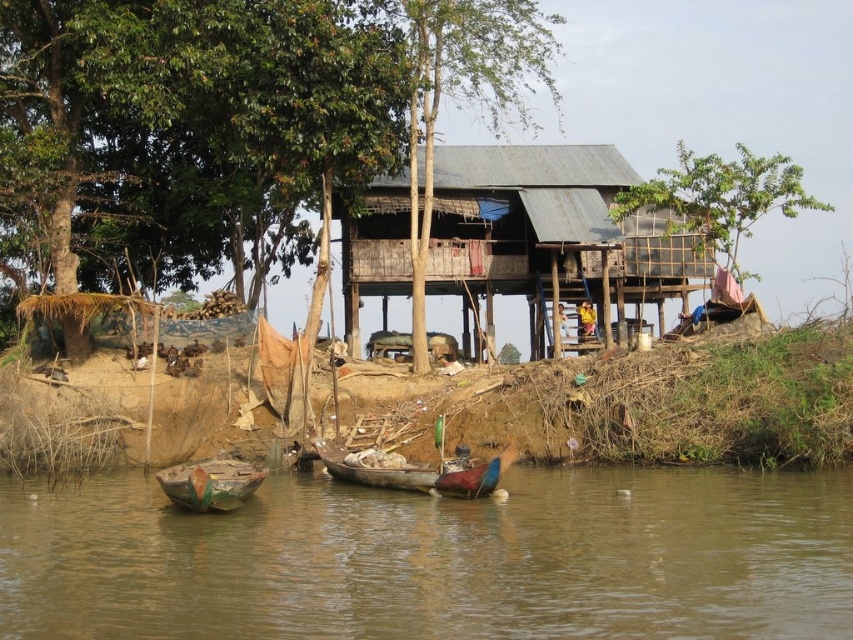
You are a visitor standing at the riverside and want to take a photo of the rusty corrugated metal hut at center and the wooden boat at lower left. If you want to capture both in the same frame, which object should you position closer to the camera to ensure both are fully visible?

To capture both the rusty corrugated metal hut at center and the wooden boat at lower left in the same frame, you should position the wooden boat at lower left closer to the camera. Since the rusty corrugated metal hut at center is taller than the wooden boat at lower left, bringing the boat nearer can balance their sizes in the photo, ensuring both are fully visible.

You are standing on the riverbank and want to board the wooden boat at lower left. Is the rusty corrugated metal hut at center blocking your path?

The rusty corrugated metal hut at center is located above the wooden boat at lower left, so it is blocking your path to the boat.

You are planning to transport a large piece of equipment that requires a minimum width of 3 meters. You have access to either the brown wooden boats at lower center or the rusty corrugated metal hut at center. Which option can accommodate your equipment based on their widths?

The brown wooden boats at lower center have a larger width compared to the rusty corrugated metal hut at center, so the equipment can be transported using the brown wooden boats at lower center if their width meets or exceeds 3 meters.